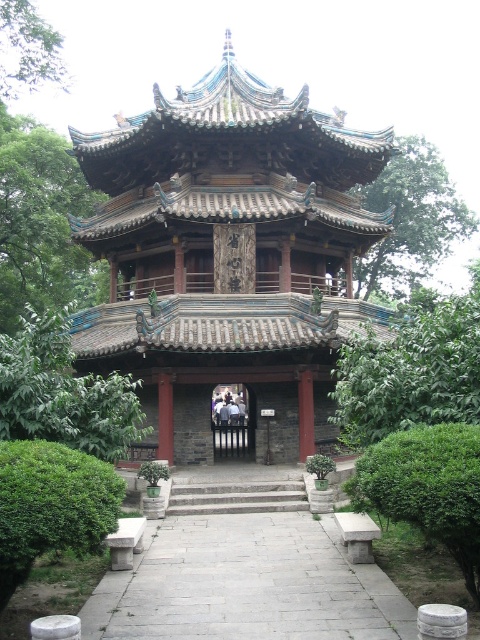
At what (x,y) coordinates should I click in order to perform the action: click on gray stone path at center. Please return your answer as a coordinate pair (x, y). Looking at the image, I should click on (248, 584).

Which is below, gray stone path at center or stone steps at center?

gray stone path at center is lower down.

What do you see at coordinates (248, 584) in the screenshot? This screenshot has width=480, height=640. I see `gray stone path at center` at bounding box center [248, 584].

Find the location of a particular element. gray stone path at center is located at coordinates (248, 584).

Is blue-tiled pagoda at center above gray stone path at center?

Yes, blue-tiled pagoda at center is above gray stone path at center.

Between blue-tiled pagoda at center and gray stone path at center, which one has less height?

gray stone path at center is shorter.

Who is more forward, [225,179] or [171,522]?

Point [171,522] is more forward.

You are a GUI agent. You are given a task and a screenshot of the screen. Output one action in this format:
    pyautogui.click(x=<x>, y=<y>)
    Task: Click on the blue-tiled pagoda at center
    
    Given the screenshot: What is the action you would take?
    pyautogui.click(x=227, y=253)

Is blue-tiled pagoda at center wider than stone steps at center?

Yes.

Which is below, blue-tiled pagoda at center or stone steps at center?

stone steps at center is below.

Locate an element on the screen. blue-tiled pagoda at center is located at coordinates (227, 253).